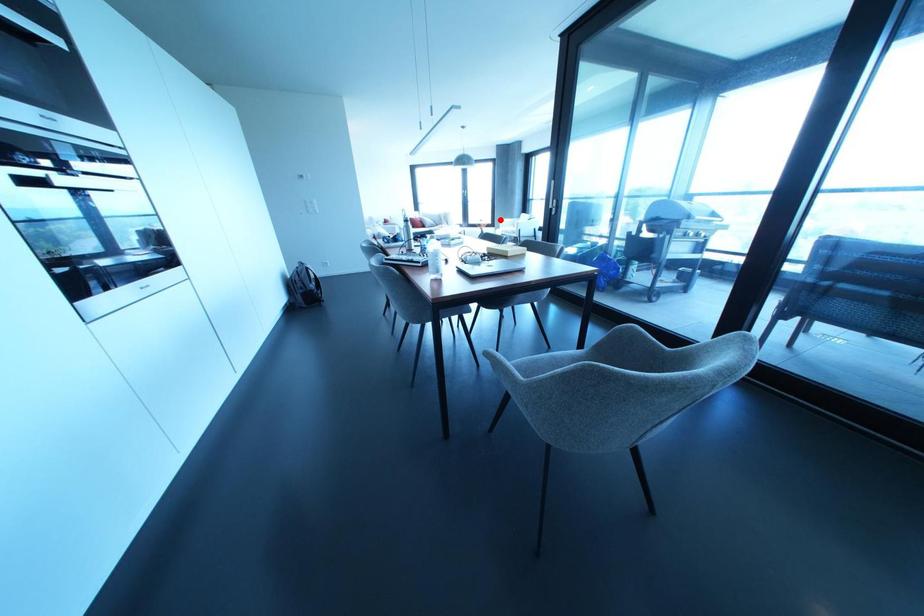
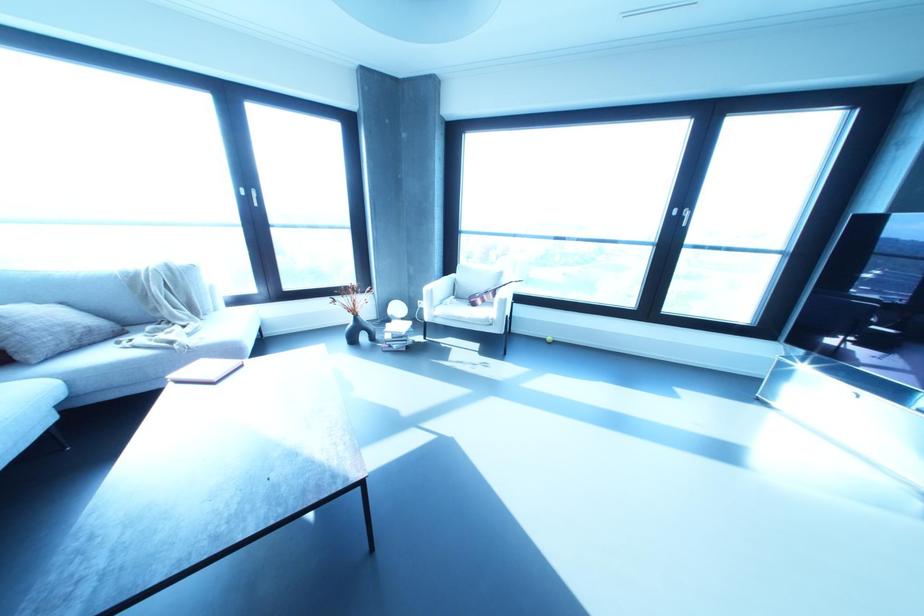
Question: I am providing you with two images of the same scene from different viewpoints. In image1, a red point is highlighted. Considering the same 3D point in image2, which of the following is correct?

Choices:
 (A) It is closer
 (B) It is farther

Answer: (A)